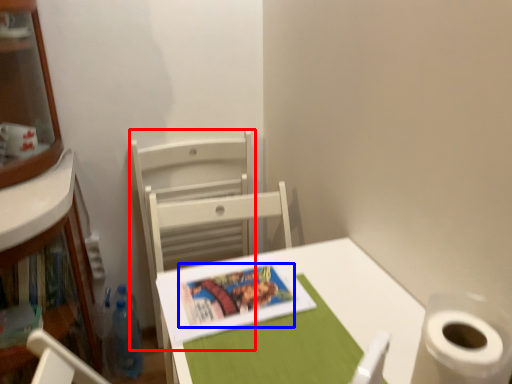
Question: Which of the following is the closest to the observer, chair (highlighted by a red box) or book cover (highlighted by a blue box)?

Choices:
 (A) chair
 (B) book cover

Answer: (B)